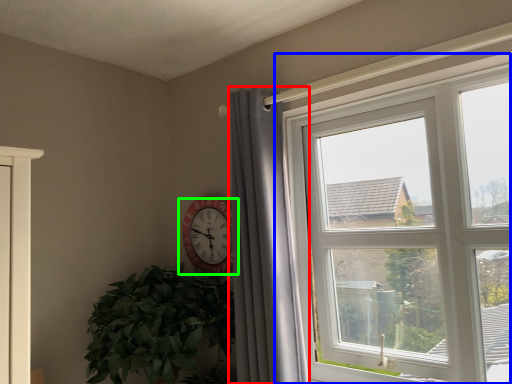
Question: Which object is positioned closest to curtain (highlighted by a red box)? Select from window (highlighted by a blue box) and wall clock (highlighted by a green box).

Choices:
 (A) window
 (B) wall clock

Answer: (B)